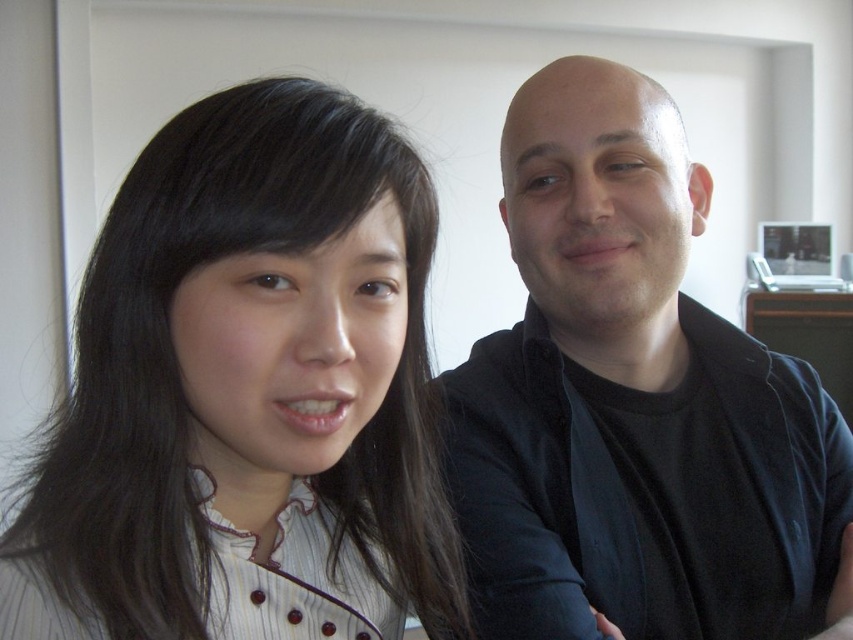
You are a photographer adjusting the lighting for a portrait. There is a point marked at coordinates (248, 394) on the image. Based on the description, what feature does this point correspond to?

The point at coordinates (248, 394) corresponds to the matte black hair at left.

Based on the coordinates provided, where is the matte black hair at left located in the image?

The matte black hair at left is located at the 2D coordinates point (248, 394) in the image.

You are taking a photo of two people in an indoor setting. You want to focus on the person closer to the camera. Which of the two points, point (213, 289) or point (704, 179), should you adjust your camera focus to ensure the person in front is sharp?

Point (213, 289) is closer to the camera than point (704, 179), so you should adjust your camera focus to point (213, 289) to ensure the person in front is sharp.